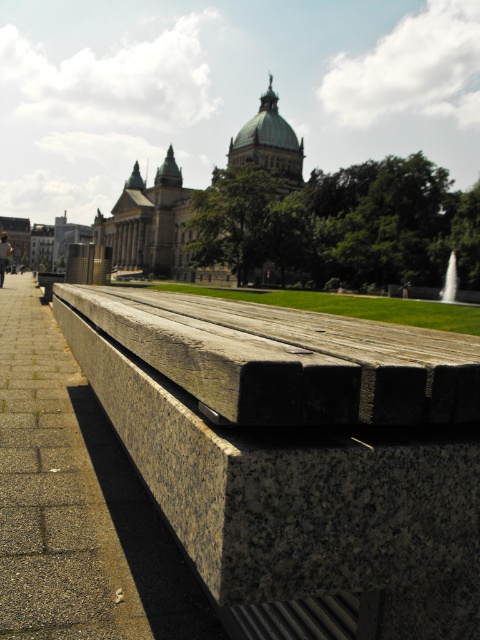
Question: Which point is closer to the camera?

Choices:
 (A) (3, 250)
 (B) (446, 275)

Answer: (A)

Question: Which object is positioned closest to the white marble fountain at center?

Choices:
 (A) granite bench at lower center
 (B) yellow helmet at upper center

Answer: (B)

Question: Which point appears farthest from the camera in this image?

Choices:
 (A) (448, 273)
 (B) (292, 436)
 (C) (2, 259)

Answer: (A)

Question: Is white marble fountain at center to the right of yellow helmet at upper center from the viewer's perspective?

Choices:
 (A) no
 (B) yes

Answer: (B)

Question: Can you confirm if granite bench at lower center is thinner than yellow helmet at upper center?

Choices:
 (A) no
 (B) yes

Answer: (B)

Question: Can you confirm if granite bench at lower center is positioned above yellow helmet at upper center?

Choices:
 (A) yes
 (B) no

Answer: (B)